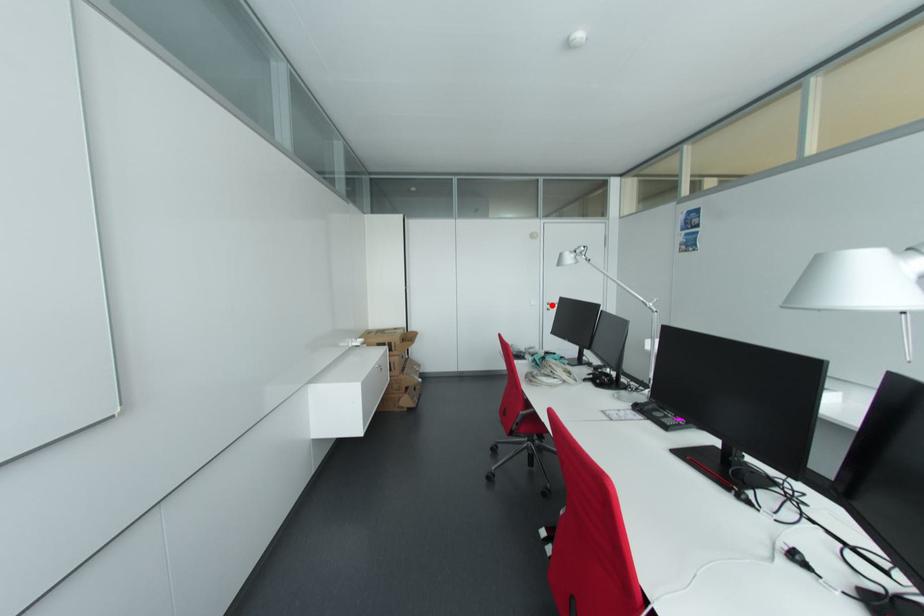
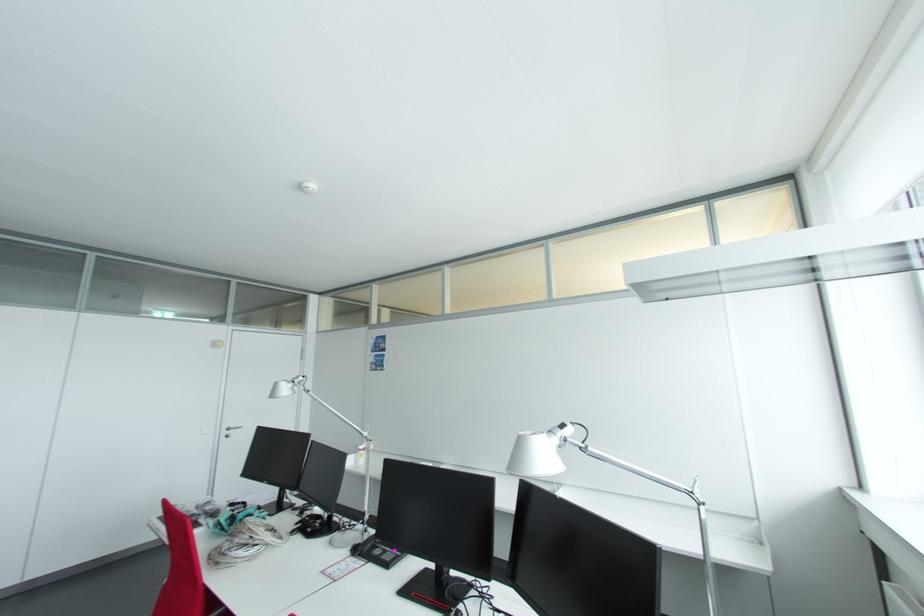
The point at the highlighted location is marked in the first image. Where is the corresponding point in the second image?

(232, 430)